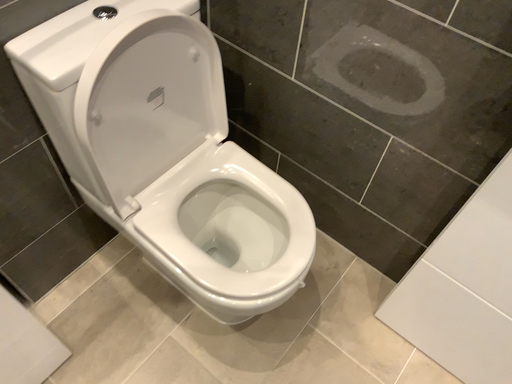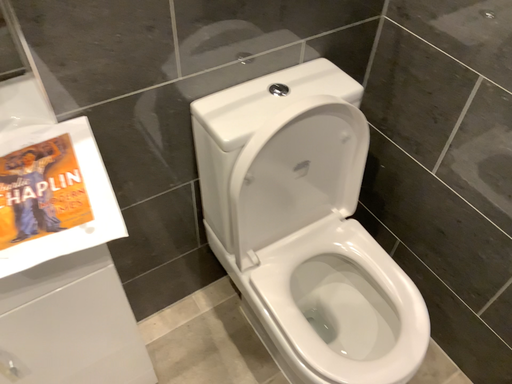
Question: How did the camera likely rotate when shooting the video?

Choices:
 (A) rotated left
 (B) rotated right

Answer: (A)